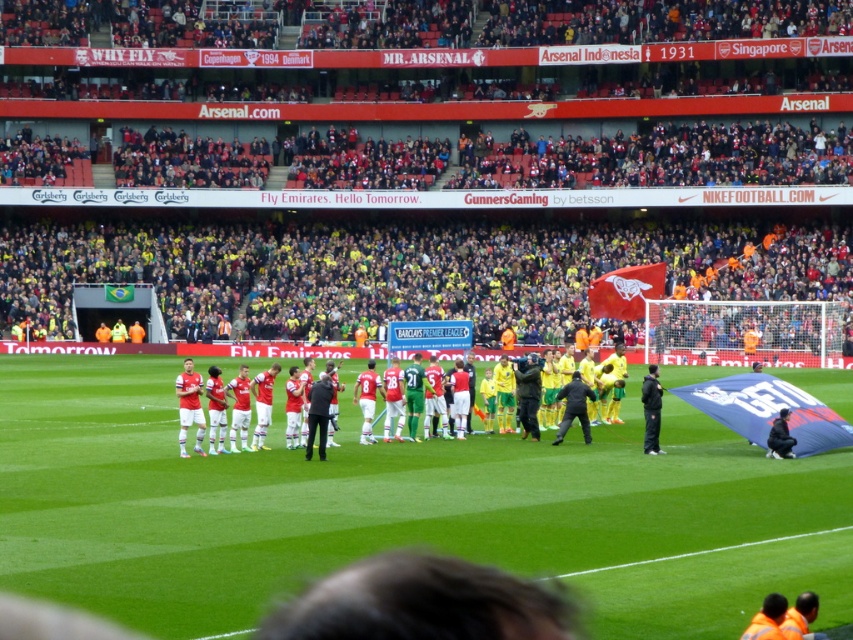
Question: Can you confirm if green grass field at center is positioned to the left of red jersey uniform at center?

Choices:
 (A) no
 (B) yes

Answer: (B)

Question: Does green grass field at center lie behind red jersey uniform at center?

Choices:
 (A) yes
 (B) no

Answer: (B)

Question: From the image, what is the correct spatial relationship of green grass field at center in relation to red jersey uniform at center?

Choices:
 (A) left
 (B) right

Answer: (A)